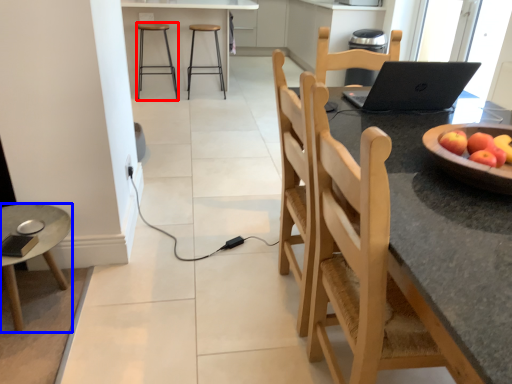
Question: Which object appears farthest to the camera in this image, stool (highlighted by a red box) or desk (highlighted by a blue box)?

Choices:
 (A) stool
 (B) desk

Answer: (A)